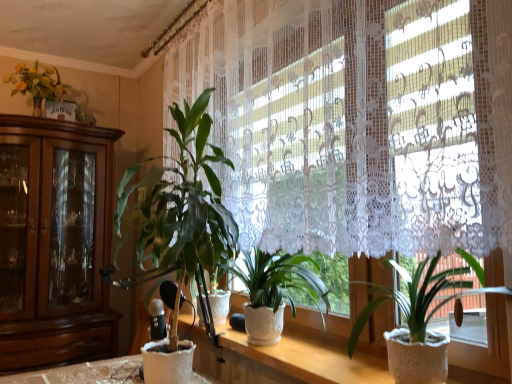
Question: Is white lace curtain at upper center far away from white textured pot at center, which appears as the third houseplant when viewed from the left?

Choices:
 (A) yes
 (B) no

Answer: (B)

Question: Does white lace curtain at upper center lie behind white textured pot at center, the first houseplant positioned from the right?

Choices:
 (A) yes
 (B) no

Answer: (B)

Question: Considering the relative sizes of white lace curtain at upper center and white textured pot at center, the first houseplant positioned from the right, in the image provided, is white lace curtain at upper center shorter than white textured pot at center, the first houseplant positioned from the right,?

Choices:
 (A) yes
 (B) no

Answer: (B)

Question: Is white lace curtain at upper center beside white textured pot at center, which appears as the third houseplant when viewed from the left?

Choices:
 (A) yes
 (B) no

Answer: (B)

Question: From a real-world perspective, is white lace curtain at upper center beneath white textured pot at center, the first houseplant positioned from the right?

Choices:
 (A) no
 (B) yes

Answer: (A)

Question: Is white lace curtain at upper center smaller than white textured pot at center, the first houseplant positioned from the right?

Choices:
 (A) no
 (B) yes

Answer: (A)

Question: Are green matte plant at center, the 3th houseplant in the right-to-left sequence, and white textured pot at center, which is counted as the 2th houseplant, starting from the left, beside each other?

Choices:
 (A) no
 (B) yes

Answer: (A)

Question: Is green matte plant at center, the 3th houseplant in the right-to-left sequence, wider than white textured pot at center, the second houseplant viewed from the right?

Choices:
 (A) yes
 (B) no

Answer: (A)

Question: From the image's perspective, would you say green matte plant at center, the 1th houseplant in the left-to-right sequence, is positioned over white textured pot at center, which is counted as the 2th houseplant, starting from the left?

Choices:
 (A) yes
 (B) no

Answer: (A)

Question: Does green matte plant at center, the 1th houseplant in the left-to-right sequence, have a smaller size compared to white textured pot at center, the second houseplant viewed from the right?

Choices:
 (A) yes
 (B) no

Answer: (B)

Question: From a real-world perspective, is green matte plant at center, the 3th houseplant in the right-to-left sequence, located higher than white textured pot at center, the second houseplant viewed from the right?

Choices:
 (A) yes
 (B) no

Answer: (A)

Question: Is green matte plant at center, the 3th houseplant in the right-to-left sequence, closer to camera compared to white textured pot at center, which is counted as the 2th houseplant, starting from the left?

Choices:
 (A) yes
 (B) no

Answer: (A)

Question: Is white textured pot at center, the second houseplant viewed from the right, positioned far away from white textured pot at center, which appears as the third houseplant when viewed from the left?

Choices:
 (A) yes
 (B) no

Answer: (B)